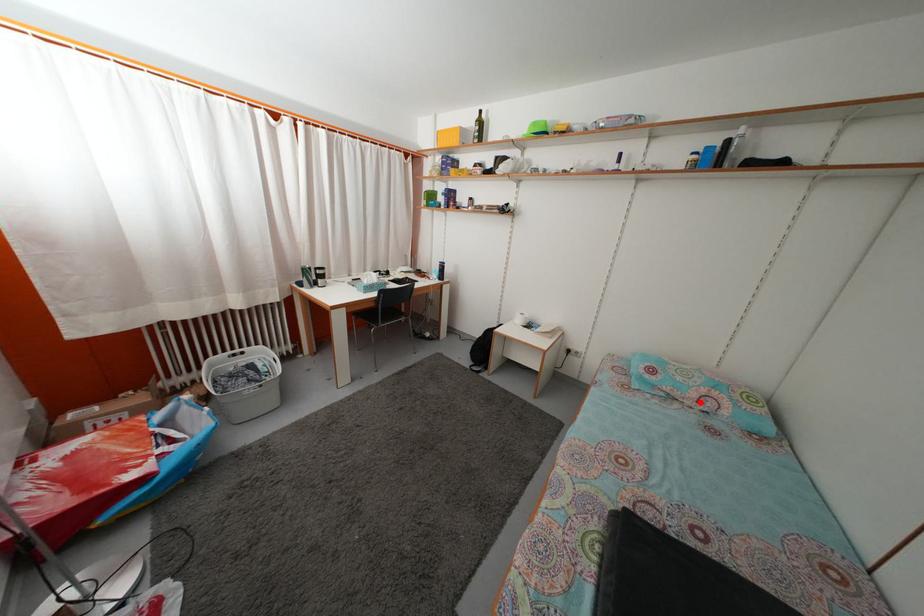
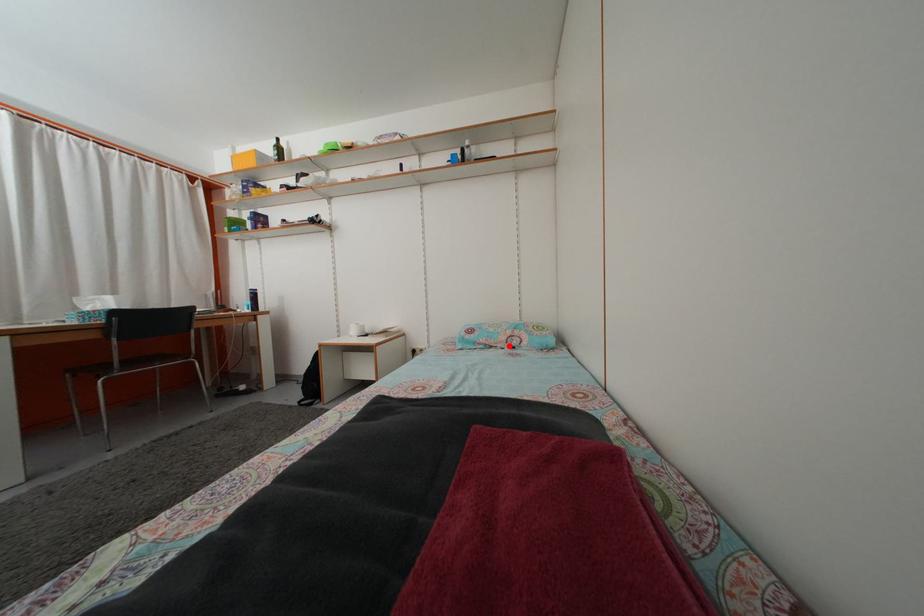
I am providing you with two images of the same scene from different viewpoints. A red point is marked on the first image and another point is marked on the second image. Is the marked point in image1 the same physical position as the marked point in image2?

Yes